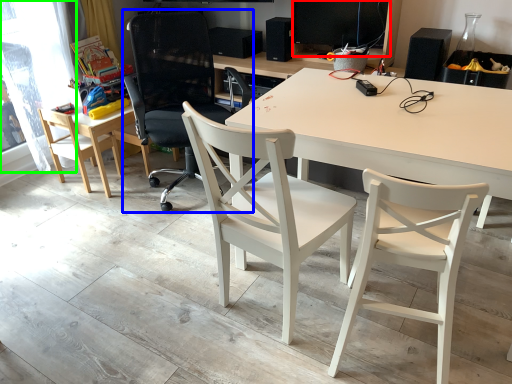
Question: Considering the real-world distances, which object is closest to computer monitor (highlighted by a red box)? chair (highlighted by a blue box) or window screen (highlighted by a green box).

Choices:
 (A) chair
 (B) window screen

Answer: (A)